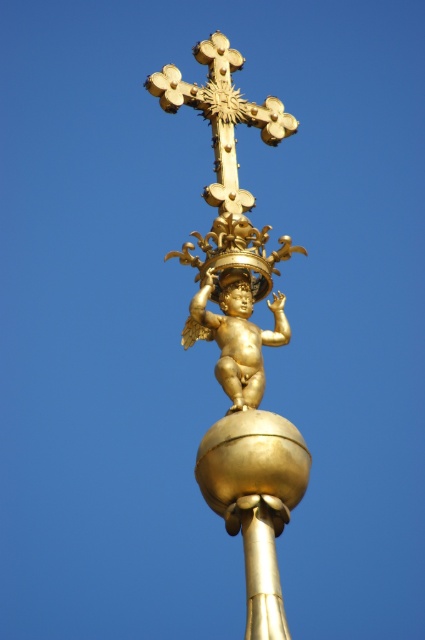
You are an architect designing a garden sculpture. You have two golden elements, the gold metallic cherub at center and the gold polished pole at center. Which element should you choose if you want the smaller one to be placed on top of the larger one?

The gold metallic cherub at center has a smaller size compared to the gold polished pole at center, so you should place the gold metallic cherub at center on top of the gold polished pole at center.

You are an architect designing a new sculpture inspired by the image. You need to ensure that the point at point (229,145) and point (258,541) are positioned correctly in terms of depth. Based on the image, which point is closer to the viewer?

Point (229,145) is further to the camera than point (258,541), so point (258,541) is closer to the viewer.

Looking at the golden ornament against the blue sky, where is the gold polished cherub at center in relation to the gold polished pole at center?

The gold polished cherub at center is to the left of the gold polished pole at center.